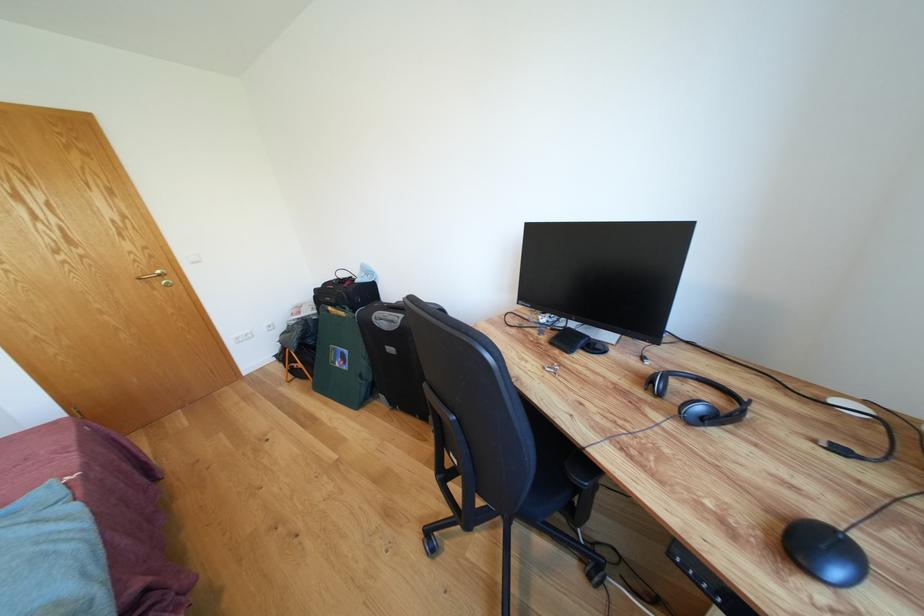
Find where to pull the gold door handle. Please return your answer as a coordinate pair (x, y).

(156, 277)